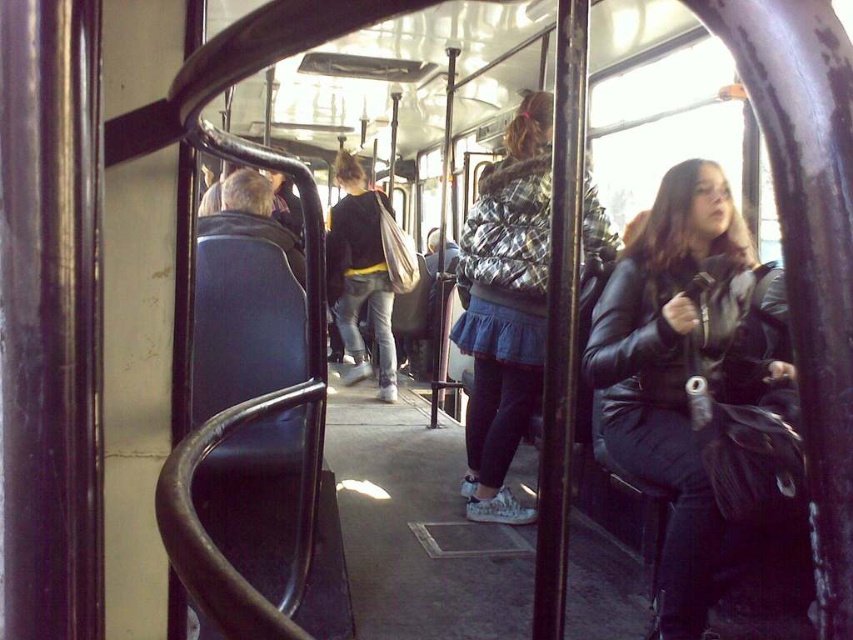
Question: Which point appears farthest from the camera in this image?

Choices:
 (A) (721, 259)
 (B) (373, 292)
 (C) (463, 493)

Answer: (B)

Question: Observing the image, what is the correct spatial positioning of leather jacket at right in reference to black leather jacket at center?

Choices:
 (A) below
 (B) above

Answer: (A)

Question: Which of these objects is positioned farthest from the plaid fur coat at center?

Choices:
 (A) leather jacket at right
 (B) black leather jacket at center

Answer: (B)

Question: Is leather jacket at right thinner than plaid fur coat at center?

Choices:
 (A) yes
 (B) no

Answer: (B)

Question: Which of the following is the farthest from the observer?

Choices:
 (A) leather jacket at right
 (B) plaid fur coat at center
 (C) black leather jacket at center

Answer: (C)

Question: Does leather jacket at right have a lesser width compared to black leather jacket at center?

Choices:
 (A) yes
 (B) no

Answer: (B)